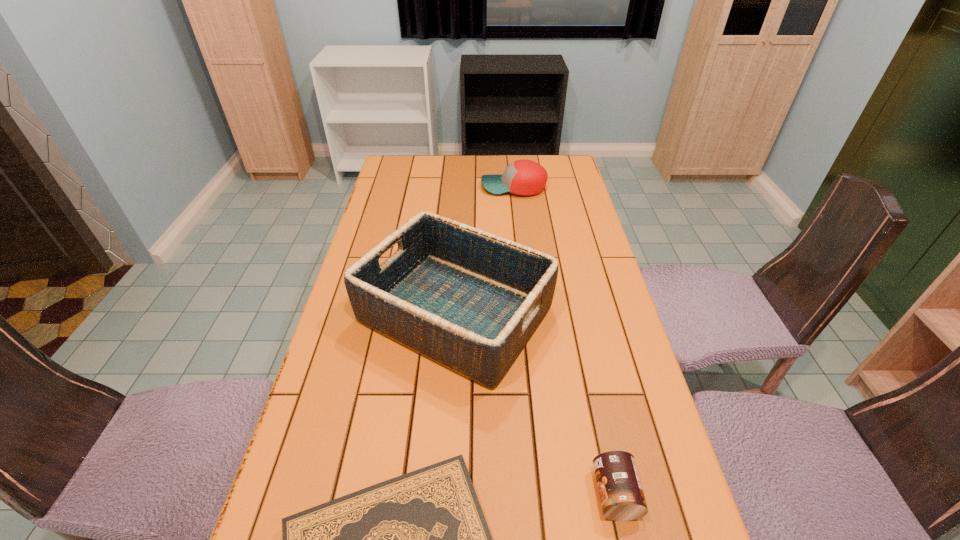
Image resolution: width=960 pixels, height=540 pixels. Identify the location of free space located 0.100m on the front label of the third tallest object. (542, 494).

Locate an element on the screen. The height and width of the screenshot is (540, 960). vacant space located 0.130m on the front label of the third tallest object is located at coordinates (526, 494).

The image size is (960, 540). What are the coordinates of `object that is at the far edge` in the screenshot? It's located at (522, 177).

At what (x,y) coordinates should I click in order to perform the action: click on object situated at the left edge. Please return your answer as a coordinate pair (x, y). Looking at the image, I should click on (467, 299).

Where is `baseball cap that is positioned at the right edge`? baseball cap that is positioned at the right edge is located at coordinates (522, 177).

Image resolution: width=960 pixels, height=540 pixels. I want to click on can present at the right edge, so click(x=621, y=495).

You are a GUI agent. You are given a task and a screenshot of the screen. Output one action in this format:
    pyautogui.click(x=<x>, y=<y>)
    Task: Click on the object that is positioned at the far right corner
    The image size is (960, 540).
    Given the screenshot: What is the action you would take?
    pyautogui.click(x=522, y=177)

Identify the location of free space at the far edge. Image resolution: width=960 pixels, height=540 pixels. (457, 178).

Locate an element on the screen. This screenshot has width=960, height=540. vacant space at the right edge of the desktop is located at coordinates (559, 286).

Where is `free region at the far left corner of the desktop`? This screenshot has width=960, height=540. free region at the far left corner of the desktop is located at coordinates (397, 179).